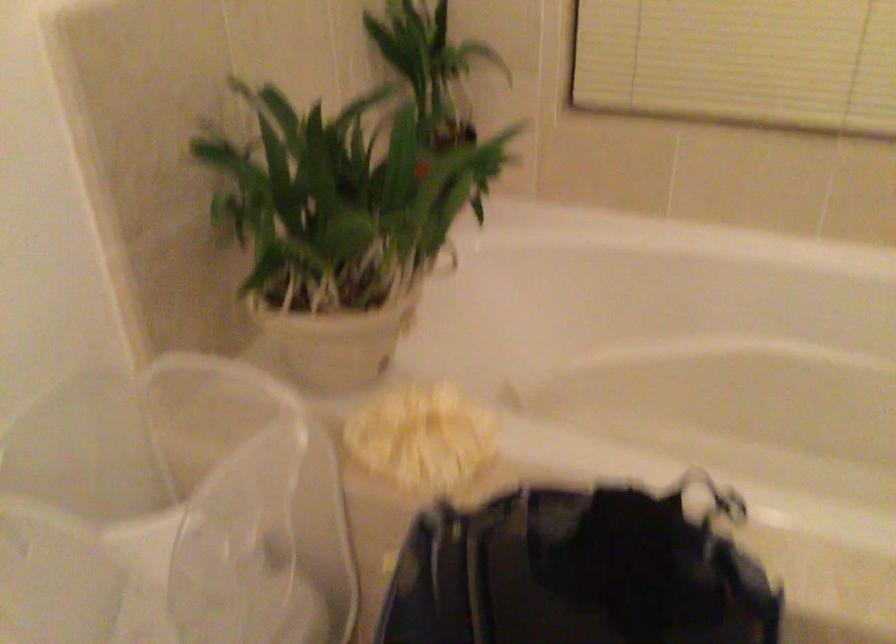
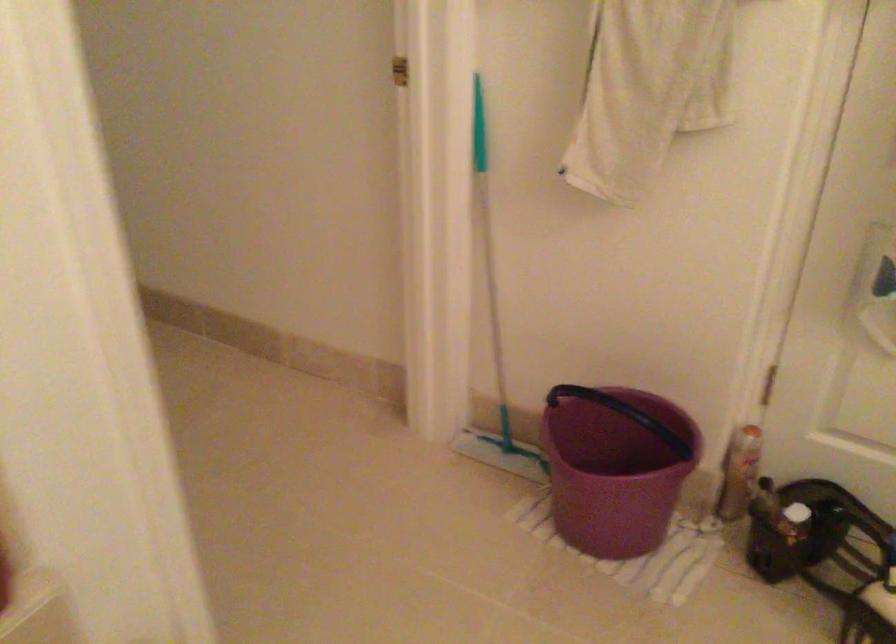
Based on the continuous images, in which direction is the camera rotating?

The rotation direction of the camera is right-down.